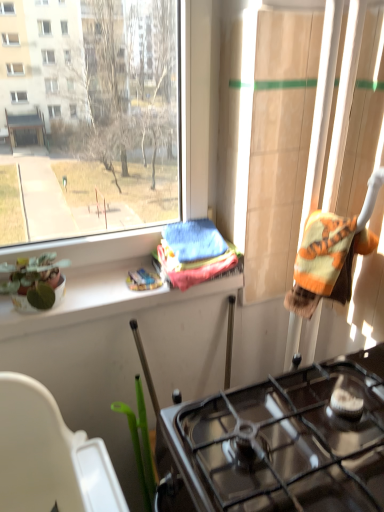
Where is `green matte plant pot at left`? green matte plant pot at left is located at coordinates (101, 300).

At what (x,y) coordinates should I click in order to perform the action: click on black glass gas stove at lower center. Please return your answer as a coordinate pair (x, y). Looking at the image, I should click on pos(282,443).

Identify the location of transparent glass window at center. Image resolution: width=384 pixels, height=512 pixels. (91, 118).

Locate an element on the screen. This screenshot has width=384, height=512. gas stove in front of the green matte plant pot at left is located at coordinates (282, 443).

Is black glass gas stove at lower center taller or shorter than green matte plant pot at left?

In the image, black glass gas stove at lower center appears to be taller than green matte plant pot at left.

Can you tell me how much black glass gas stove at lower center and green matte plant pot at left differ in facing direction?

There is a 89.4-degree angle between the facing directions of black glass gas stove at lower center and green matte plant pot at left.

Does green matte plant pot at left appear on the right side of transparent glass window at center?

Yes.

In the image, is green matte plant pot at left positioned in front of or behind transparent glass window at center?

green matte plant pot at left is behind transparent glass window at center.

In the scene shown: Between green matte plant pot at left and transparent glass window at center, which one has larger size?

Bigger between the two is transparent glass window at center.

How much distance is there between green matte plant pot at left and transparent glass window at center?

green matte plant pot at left and transparent glass window at center are 12.36 inches apart from each other.

Which is more to the right, black glass gas stove at lower center or transparent glass window at center?

black glass gas stove at lower center is more to the right.

Is black glass gas stove at lower center in contact with transparent glass window at center?

black glass gas stove at lower center is not next to transparent glass window at center, and they're not touching.

Considering the relative sizes of black glass gas stove at lower center and transparent glass window at center in the image provided, is black glass gas stove at lower center shorter than transparent glass window at center?

Yes, black glass gas stove at lower center is shorter than transparent glass window at center.

Based on their sizes in the image, would you say transparent glass window at center is bigger or smaller than black glass gas stove at lower center?

transparent glass window at center is smaller than black glass gas stove at lower center.

Is the depth of transparent glass window at center greater than that of black glass gas stove at lower center?

Yes, transparent glass window at center is further from the camera.

Which object is positioned more to the right, transparent glass window at center or black glass gas stove at lower center?

black glass gas stove at lower center.

How different are the orientations of transparent glass window at center and black glass gas stove at lower center in degrees?

transparent glass window at center and black glass gas stove at lower center are facing 89.7 degrees away from each other.

Based on the photo, is green matte plant pot at left shorter than black glass gas stove at lower center?

Yes.

Is green matte plant pot at left far away from black glass gas stove at lower center?

No.

In the scene shown: Would you say green matte plant pot at left is inside or outside black glass gas stove at lower center?

green matte plant pot at left is spatially situated outside black glass gas stove at lower center.

Is the position of green matte plant pot at left more distant than that of black glass gas stove at lower center?

Yes, green matte plant pot at left is further from the camera.

Based on the photo, considering the relative positions of black glass gas stove at lower center and green glossy plant pot at lower left in the image provided, is black glass gas stove at lower center to the left of green glossy plant pot at lower left from the viewer's perspective?

No, black glass gas stove at lower center is not to the left of green glossy plant pot at lower left.

From the image's perspective, who appears lower, black glass gas stove at lower center or green glossy plant pot at lower left?

black glass gas stove at lower center, from the image's perspective.

Which is in front, point (371, 498) or point (47, 259)?

Positioned in front is point (371, 498).

Does black glass gas stove at lower center touch green glossy plant pot at lower left?

No.

From the image's perspective, is green glossy plant pot at lower left beneath green matte plant pot at left?

No, from the image's perspective, green glossy plant pot at lower left is not beneath green matte plant pot at left.

Where is `ledge below the green glossy plant pot at lower left (from the image's perspective)`? ledge below the green glossy plant pot at lower left (from the image's perspective) is located at coordinates point(101,300).

How much distance is there between green glossy plant pot at lower left and green matte plant pot at left?

green glossy plant pot at lower left and green matte plant pot at left are 4.58 inches apart.

From a real-world perspective, which object stands above the other?

From a 3D spatial view, green glossy plant pot at lower left is above.

Identify the location of gas stove located on the right of green matte plant pot at left. The height and width of the screenshot is (512, 384). (282, 443).

Find the location of a particular element. The width and height of the screenshot is (384, 512). window above the green matte plant pot at left (from a real-world perspective) is located at coordinates (91, 118).

Which object lies further to the anchor point green matte plant pot at left, green glossy plant pot at lower left or black glass gas stove at lower center?

black glass gas stove at lower center is positioned further to the anchor green matte plant pot at left.

From the image, which object appears to be farther from green glossy plant pot at lower left, black glass gas stove at lower center or transparent glass window at center?

A: black glass gas stove at lower center is positioned further to the anchor green glossy plant pot at lower left.

When comparing their distances from green matte plant pot at left, does transparent glass window at center or green glossy plant pot at lower left seem further?

Among the two, transparent glass window at center is located further to green matte plant pot at left.

Looking at this image, estimate the real-world distances between objects in this image. Which object is further from green matte plant pot at left, black glass gas stove at lower center or green glossy plant pot at lower left?

Among the two, black glass gas stove at lower center is located further to green matte plant pot at left.

When comparing their distances from green glossy plant pot at lower left, does transparent glass window at center or green matte plant pot at left seem further?

The object further to green glossy plant pot at lower left is transparent glass window at center.

Based on their spatial positions, is transparent glass window at center or green glossy plant pot at lower left closer to black glass gas stove at lower center?

Among the two, green glossy plant pot at lower left is located nearer to black glass gas stove at lower center.

Based on their spatial positions, is green glossy plant pot at lower left or green matte plant pot at left closer to transparent glass window at center?

green glossy plant pot at lower left lies closer to transparent glass window at center than the other object.

When comparing their distances from green glossy plant pot at lower left, does green matte plant pot at left or transparent glass window at center seem closer?

green matte plant pot at left is closer to green glossy plant pot at lower left.

Locate an element on the screen. This screenshot has width=384, height=512. ledge between transparent glass window at center and black glass gas stove at lower center from top to bottom is located at coordinates (101, 300).

The image size is (384, 512). In order to click on ledge located between green glossy plant pot at lower left and black glass gas stove at lower center in the left-right direction in this screenshot , I will do `click(101, 300)`.

Find the location of a particular element. The width and height of the screenshot is (384, 512). houseplant between transparent glass window at center and black glass gas stove at lower center from top to bottom is located at coordinates (35, 282).

Identify the location of houseplant between transparent glass window at center and green matte plant pot at left in the up-down direction. (35, 282).